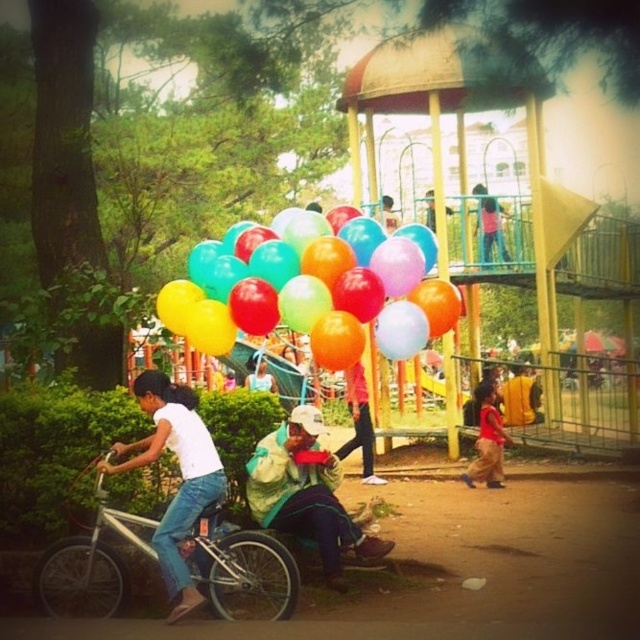
Question: Among these points, which one is farthest from the camera?

Choices:
 (A) (394, 289)
 (B) (490, 413)
 (C) (42, 604)

Answer: (B)

Question: Considering the real-world distances, which object is farthest from the multicolored balloons at center?

Choices:
 (A) red cotton shirt at lower right
 (B) silver metallic bicycle at center

Answer: (A)

Question: Which object appears farthest from the camera in this image?

Choices:
 (A) red cotton shirt at lower right
 (B) silver metallic bicycle at center

Answer: (A)

Question: Where is multicolored balloons at center located in relation to silver metallic bicycle at center in the image?

Choices:
 (A) left
 (B) right

Answer: (B)

Question: Does silver metallic bicycle at center appear on the right side of red cotton shirt at lower right?

Choices:
 (A) no
 (B) yes

Answer: (A)

Question: Is multicolored balloons at center closer to camera compared to silver metallic bicycle at center?

Choices:
 (A) no
 (B) yes

Answer: (A)